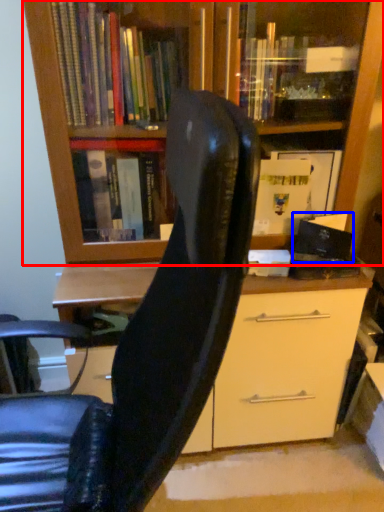
Question: Which of the following is the closest to the observer, bookcase (highlighted by a red box) or paperback book (highlighted by a blue box)?

Choices:
 (A) bookcase
 (B) paperback book

Answer: (A)